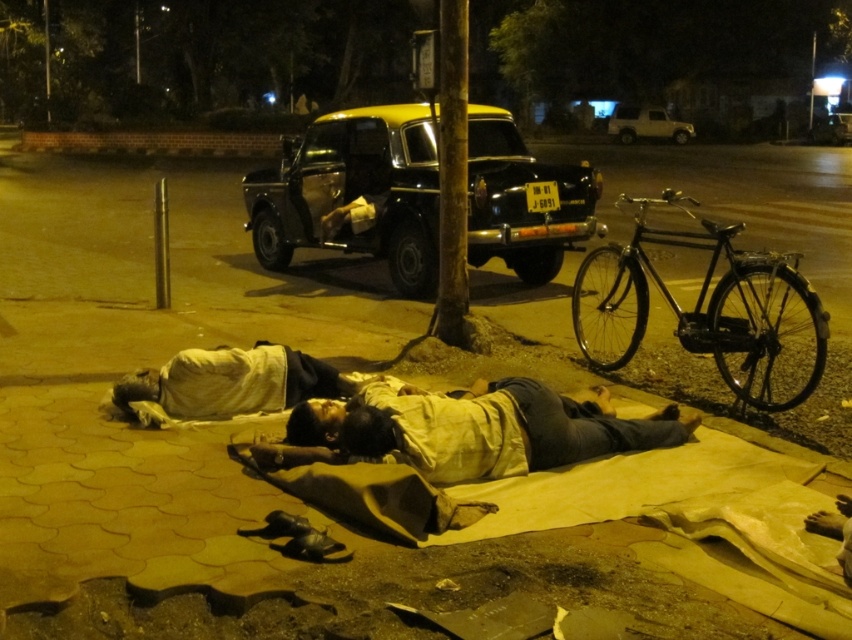
Is light beige fabric at lower center further to the viewer compared to metallic gold car at upper right?

No, light beige fabric at lower center is in front of metallic gold car at upper right.

Is light beige fabric at lower center above metallic gold car at upper right?

Incorrect, light beige fabric at lower center is not positioned above metallic gold car at upper right.

Locate an element on the screen. The image size is (852, 640). light beige fabric at lower center is located at coordinates (471, 429).

Who is lower down, yellow painted metal taxi at center or light beige fabric at lower center?

light beige fabric at lower center

Is point (318, 193) farther from viewer compared to point (579, 424)?

Yes, point (318, 193) is farther from viewer.

Identify the location of yellow painted metal taxi at center. (353, 193).

Does yellow painted metal taxi at center lie in front of metallic gold car at upper right?

Yes, it is.

Does yellow painted metal taxi at center have a greater width compared to metallic gold car at upper right?

In fact, yellow painted metal taxi at center might be narrower than metallic gold car at upper right.

Between point (401, 285) and point (616, 116), which one is positioned in front?

Point (401, 285) is more forward.

At what (x,y) coordinates should I click in order to perform the action: click on yellow painted metal taxi at center. Please return your answer as a coordinate pair (x, y). Looking at the image, I should click on (353, 193).